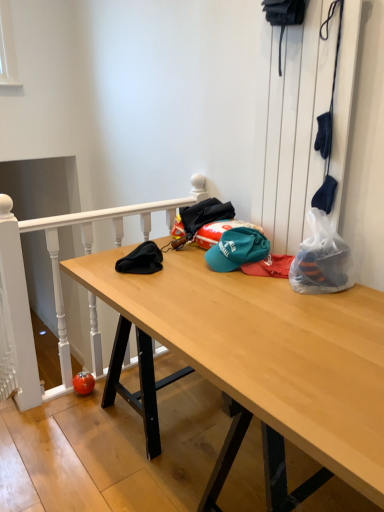
What do you see at coordinates (54, 287) in the screenshot?
I see `white wood rail at upper left` at bounding box center [54, 287].

Image resolution: width=384 pixels, height=512 pixels. What do you see at coordinates (256, 362) in the screenshot?
I see `light wood desk at center` at bounding box center [256, 362].

Where is `white wood rail at upper left`? The width and height of the screenshot is (384, 512). white wood rail at upper left is located at coordinates (54, 287).

Considering the relative sizes of light wood desk at center and translucent plastic bag at right in the image provided, is light wood desk at center bigger than translucent plastic bag at right?

Correct, light wood desk at center is larger in size than translucent plastic bag at right.

Find the location of a particular element. plastic bag positioned vertically above the light wood desk at center (from a real-world perspective) is located at coordinates (321, 259).

From a real-world perspective, is light wood desk at center located higher than translucent plastic bag at right?

No, from a real-world perspective, light wood desk at center is not above translucent plastic bag at right.

Considering the positions of point (311, 434) and point (348, 286), is point (311, 434) closer or farther from the camera than point (348, 286)?

Point (311, 434).

Is white wood rail at upper left not inside light wood desk at center?

Yes, white wood rail at upper left is outside of light wood desk at center.

From the image's perspective, which object appears higher, white wood rail at upper left or light wood desk at center?

white wood rail at upper left appears higher in the image.

Is white wood rail at upper left far away from light wood desk at center?

No, white wood rail at upper left is not far away from light wood desk at center.

How distant is white wood rail at upper left from teal fabric cap at center?

white wood rail at upper left and teal fabric cap at center are 33.04 inches apart from each other.

Is white wood rail at upper left facing towards teal fabric cap at center?

Yes, white wood rail at upper left is facing teal fabric cap at center.

From the image's perspective, who appears lower, white wood rail at upper left or teal fabric cap at center?

white wood rail at upper left.

Can we say translucent plastic bag at right lies outside teal fabric cap at center?

Indeed, translucent plastic bag at right is completely outside teal fabric cap at center.

From the image's perspective, is translucent plastic bag at right positioned above or below teal fabric cap at center?

Clearly, from the image's perspective, translucent plastic bag at right is below teal fabric cap at center.

Is the depth of translucent plastic bag at right less than that of teal fabric cap at center?

Yes, translucent plastic bag at right is closer to the camera.

Where is `hat that is under the translucent plastic bag at right (from a real-world perspective)`? hat that is under the translucent plastic bag at right (from a real-world perspective) is located at coordinates (237, 249).

From the picture: Is white wood rail at upper left thinner than translucent plastic bag at right?

Yes, white wood rail at upper left is thinner than translucent plastic bag at right.

Is white wood rail at upper left at the left side of translucent plastic bag at right?

Correct, you'll find white wood rail at upper left to the left of translucent plastic bag at right.

From a real-world perspective, between white wood rail at upper left and translucent plastic bag at right, who is vertically lower?

white wood rail at upper left, from a real-world perspective.

What's the angular difference between white wood rail at upper left and translucent plastic bag at right's facing directions?

The angle between the facing direction of white wood rail at upper left and the facing direction of translucent plastic bag at right is 90 degrees.

Is light wood desk at center far from teal fabric cap at center?

light wood desk at center is actually quite close to teal fabric cap at center.

Looking at their sizes, would you say light wood desk at center is wider or thinner than teal fabric cap at center?

Considering their sizes, light wood desk at center looks broader than teal fabric cap at center.

You are a GUI agent. You are given a task and a screenshot of the screen. Output one action in this format:
    pyautogui.click(x=<x>, y=<y>)
    Task: Click on the hat lying above the light wood desk at center (from the image's perspective)
    
    Given the screenshot: What is the action you would take?
    pyautogui.click(x=237, y=249)

From a real-world perspective, between translucent plastic bag at right and light wood desk at center, who is vertically higher?

translucent plastic bag at right, from a real-world perspective.

Find the location of a particular element. desk below the translucent plastic bag at right (from the image's perspective) is located at coordinates (256, 362).

Which object is thinner, translucent plastic bag at right or light wood desk at center?

Thinner between the two is translucent plastic bag at right.

Locate an element on the screen. Image resolution: width=384 pixels, height=512 pixels. desk on the left of translucent plastic bag at right is located at coordinates (256, 362).

Where is `desk that is on the right side of white wood rail at upper left`? The width and height of the screenshot is (384, 512). desk that is on the right side of white wood rail at upper left is located at coordinates (256, 362).

When comparing their distances from teal fabric cap at center, does white wood rail at upper left or translucent plastic bag at right seem closer?

translucent plastic bag at right.

Which object lies further to the anchor point teal fabric cap at center, light wood desk at center or translucent plastic bag at right?

light wood desk at center is positioned further to the anchor teal fabric cap at center.

Based on the photo, which object lies nearer to the anchor point light wood desk at center, teal fabric cap at center or translucent plastic bag at right?

Among the two, translucent plastic bag at right is located nearer to light wood desk at center.

Looking at the image, which one is located further to teal fabric cap at center, light wood desk at center or white wood rail at upper left?

Among the two, white wood rail at upper left is located further to teal fabric cap at center.

When comparing their distances from translucent plastic bag at right, does teal fabric cap at center or white wood rail at upper left seem closer?

Based on the image, teal fabric cap at center appears to be nearer to translucent plastic bag at right.

Which object lies nearer to the anchor point light wood desk at center, translucent plastic bag at right or teal fabric cap at center?

The object closer to light wood desk at center is translucent plastic bag at right.

From the image, which object appears to be farther from white wood rail at upper left, translucent plastic bag at right or teal fabric cap at center?

translucent plastic bag at right.

Which object lies nearer to the anchor point translucent plastic bag at right, teal fabric cap at center or light wood desk at center?

teal fabric cap at center.

At what (x,y) coordinates should I click in order to perform the action: click on rail between translucent plastic bag at right and light wood desk at center from top to bottom. Please return your answer as a coordinate pair (x, y). Looking at the image, I should click on (54, 287).

Image resolution: width=384 pixels, height=512 pixels. I want to click on rail between teal fabric cap at center and light wood desk at center in the up-down direction, so click(x=54, y=287).

Identify the location of plastic bag between teal fabric cap at center and light wood desk at center in the vertical direction. (321, 259).

This screenshot has width=384, height=512. In order to click on hat located between white wood rail at upper left and translucent plastic bag at right in the left-right direction in this screenshot , I will do `click(237, 249)`.